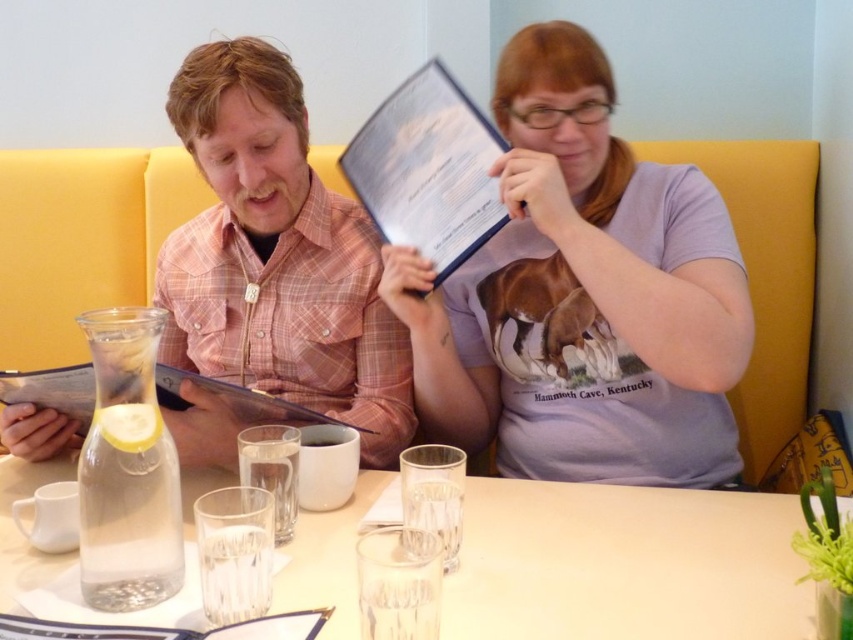
Question: Can you confirm if white paper menu at upper center is thinner than matte plastic clipboard at left?

Choices:
 (A) no
 (B) yes

Answer: (B)

Question: Is pink plaid shirt at center thinner than matte plastic clipboard at left?

Choices:
 (A) yes
 (B) no

Answer: (B)

Question: Which point is closer to the camera?

Choices:
 (A) pink plaid shirt at center
 (B) clear glass water at center
 (C) matte plastic clipboard at left

Answer: (B)

Question: Is white paper menu at upper center below matte plastic clipboard at left?

Choices:
 (A) no
 (B) yes

Answer: (A)

Question: Which point appears farthest from the camera in this image?

Choices:
 (A) (471, 586)
 (B) (4, 381)

Answer: (B)

Question: Which object is closer to the camera taking this photo?

Choices:
 (A) clear glass water at center
 (B) pink plaid shirt at center

Answer: (A)